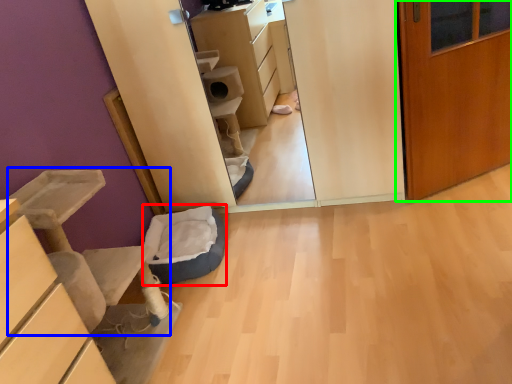
Question: Which object is the farthest from cat bed (highlighted by a red box)? Choose among these: furniture (highlighted by a blue box) or door (highlighted by a green box).

Choices:
 (A) furniture
 (B) door

Answer: (B)